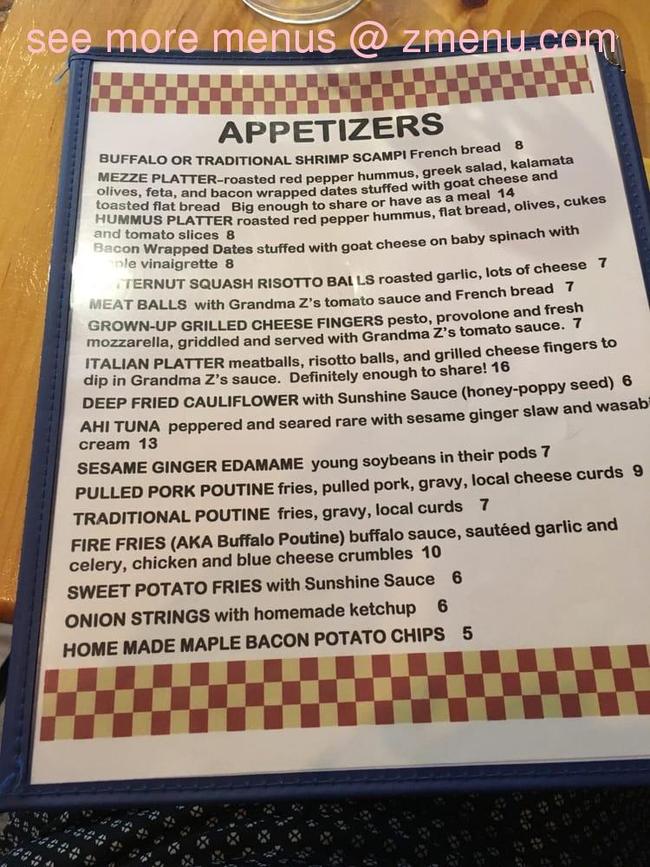
Identify the location of clear menu cover. The height and width of the screenshot is (867, 650). (132, 133).